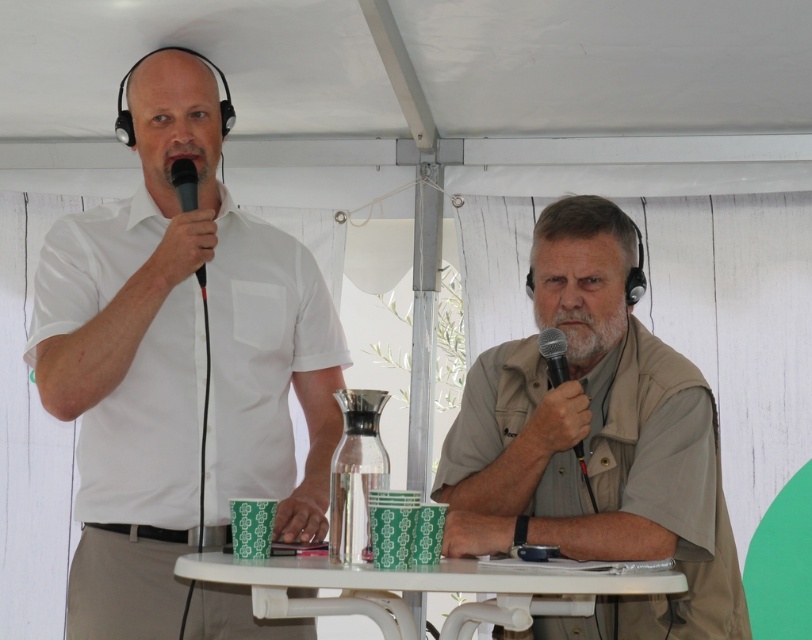
Is point (543, 452) in front of point (314, 570)?

No, it is not.

Can you confirm if beige fabric vest at center is shorter than white plastic table at center?

Incorrect, beige fabric vest at center's height does not fall short of white plastic table at center's.

Find the location of a particular element. This screenshot has height=640, width=812. beige fabric vest at center is located at coordinates (595, 442).

Between point (412, 625) and point (547, 371), which one is positioned behind?

Positioned behind is point (547, 371).

Is white plastic table at center above black matte microphone at center?

No, white plastic table at center is not above black matte microphone at center.

Between point (270, 580) and point (551, 364), which one is positioned behind?

Point (551, 364)

Find the location of a particular element. This screenshot has height=640, width=812. white plastic table at center is located at coordinates (432, 588).

Between white plastic table at center and black matte microphone at left, which one appears on the right side from the viewer's perspective?

From the viewer's perspective, white plastic table at center appears more on the right side.

Is white plastic table at center shorter than black matte microphone at left?

Yes, white plastic table at center is shorter than black matte microphone at left.

Who is more distant from viewer, (460,625) or (192,205)?

The point (192,205) is more distant.

Locate an element on the screen. This screenshot has width=812, height=640. white plastic table at center is located at coordinates (432, 588).